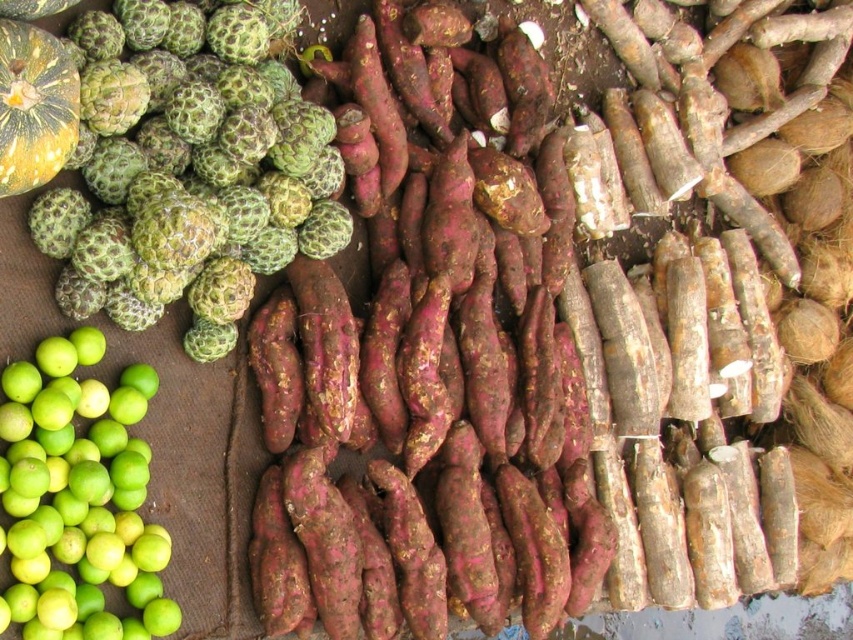
Which is in front, point (225, 236) or point (77, 600)?

Point (77, 600)

How far apart are green rough textured fruit at upper left and green matte lime at lower left?

green rough textured fruit at upper left and green matte lime at lower left are 10.87 inches apart from each other.

Consider the image. Who is more forward, (309, 240) or (90, 397)?

Point (90, 397)

Locate an element on the screen. The width and height of the screenshot is (853, 640). green rough textured fruit at upper left is located at coordinates (192, 170).